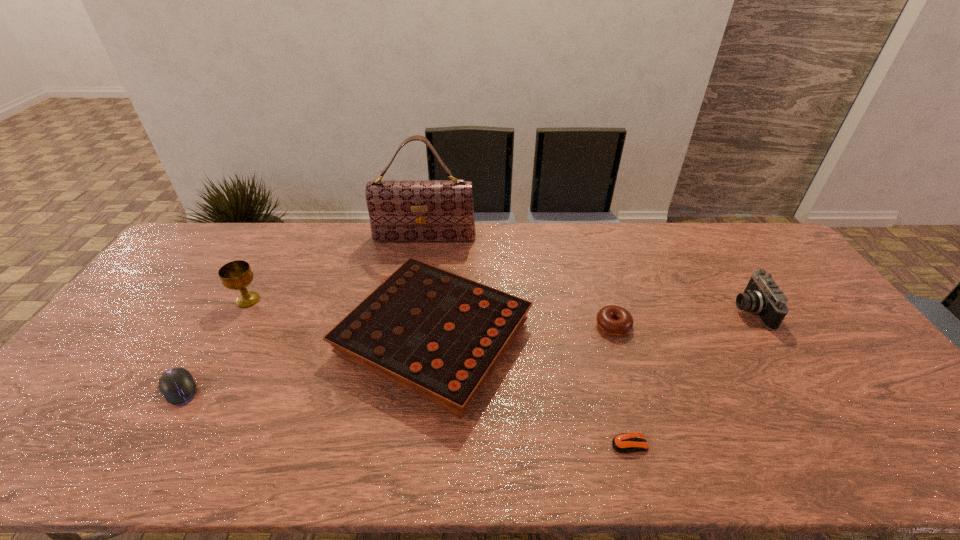
I want to click on blank region between the shorter computer mouse and the doughnut, so [621, 385].

The height and width of the screenshot is (540, 960). I want to click on unoccupied area between the second shortest object and the chalice, so click(x=214, y=345).

At what (x,y) coordinates should I click in order to perform the action: click on unoccupied area between the doughnut and the gameboard. Please return your answer as a coordinate pair (x, y). Looking at the image, I should click on (523, 332).

Locate which object ranks sixth in proximity to the farthest object. Please provide its 2D coordinates. Your answer should be formatted as a tuple, i.e. [(x, y)], where the tuple contains the x and y coordinates of a point satisfying the conditions above.

[(762, 296)]

Identify the location of object that stands as the fifth closest to the farther computer mouse. (615, 320).

The height and width of the screenshot is (540, 960). I want to click on free point that satisfies the following two spatial constraints: 1. on the front side of the doughnut; 2. on the right side of the chalice, so click(233, 326).

You are a GUI agent. You are given a task and a screenshot of the screen. Output one action in this format:
    pyautogui.click(x=<x>, y=<y>)
    Task: Click on the vacant space that satisfies the following two spatial constraints: 1. on the front-facing side of the camera; 2. on the front side of the fourth shortest object
    The height and width of the screenshot is (540, 960).
    Given the screenshot: What is the action you would take?
    pyautogui.click(x=768, y=338)

Locate an element on the screen. vacant space that satisfies the following two spatial constraints: 1. on the front-facing side of the rightmost object; 2. on the front side of the right computer mouse is located at coordinates (836, 444).